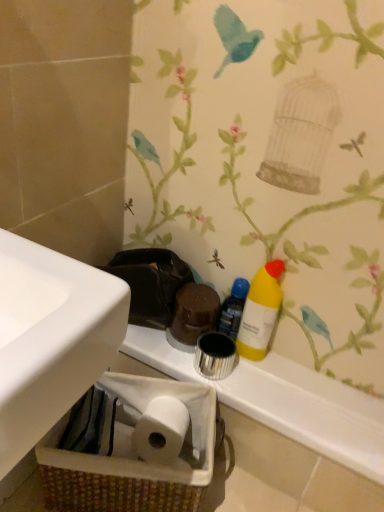
Question: Looking at their shapes, would you say white glossy counter top at center is wider or thinner than yellow matte bottle at right?

Choices:
 (A) thin
 (B) wide

Answer: (B)

Question: Is point (362, 468) closer or farther from the camera than point (243, 284)?

Choices:
 (A) closer
 (B) farther

Answer: (A)

Question: Which of these objects is positioned farthest from the yellow matte bottle at center right?

Choices:
 (A) yellow matte bottle at right
 (B) brown woven basket at lower left
 (C) white glossy counter top at center

Answer: (B)

Question: Estimate the real-world distances between objects in this image. Which object is closer to the brown woven basket at lower left?

Choices:
 (A) white glossy counter top at center
 (B) yellow matte bottle at center right
 (C) yellow matte bottle at right

Answer: (A)